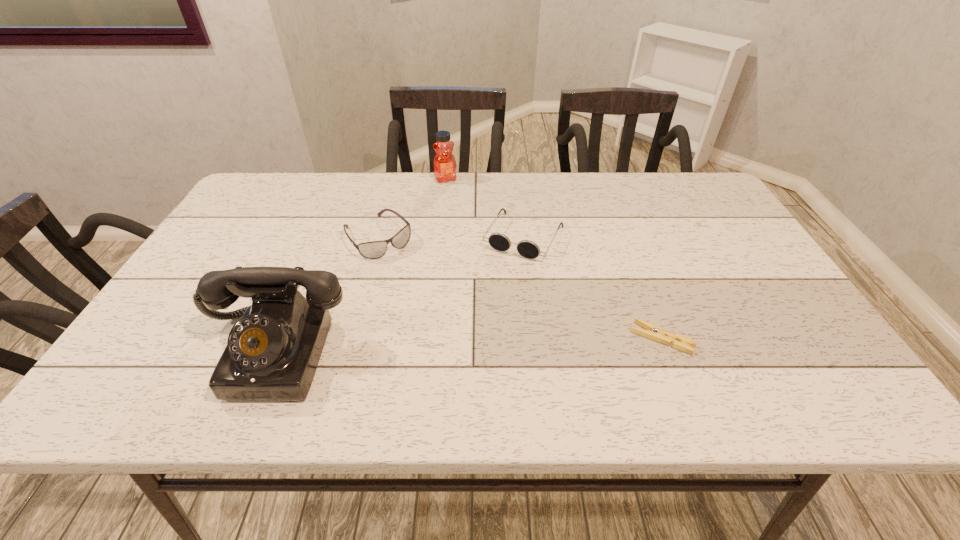
Find the location of a particular element. This screenshot has width=960, height=540. unoccupied position between the fourth object from left to right and the clothespin is located at coordinates (593, 288).

You are a GUI agent. You are given a task and a screenshot of the screen. Output one action in this format:
    pyautogui.click(x=<x>, y=<y>)
    Task: Click on the vacant point located between the third object from left to right and the fourth object from left to right
    This screenshot has width=960, height=540.
    Given the screenshot: What is the action you would take?
    (x=485, y=208)

Image resolution: width=960 pixels, height=540 pixels. Find the location of `empty space that is in between the right sunglasses and the left sunglasses`. empty space that is in between the right sunglasses and the left sunglasses is located at coordinates (451, 237).

Identify the location of free space between the left sunglasses and the rightmost object. The height and width of the screenshot is (540, 960). (520, 288).

You are a GUI agent. You are given a task and a screenshot of the screen. Output one action in this format:
    pyautogui.click(x=<x>, y=<y>)
    Task: Click on the vacant area that lies between the clothespin and the second object from right to left
    The width and height of the screenshot is (960, 540).
    Given the screenshot: What is the action you would take?
    pyautogui.click(x=593, y=288)

The height and width of the screenshot is (540, 960). In order to click on free space between the telephone and the honey in this screenshot , I will do `click(360, 265)`.

In order to click on empty space between the left sunglasses and the fourth object from left to right in this screenshot , I will do `click(451, 237)`.

This screenshot has height=540, width=960. I want to click on free spot between the fourth shortest object and the right sunglasses, so click(x=485, y=208).

Identify which object is located as the nearest to the second object from right to left. Please provide its 2D coordinates. Your answer should be formatted as a tuple, i.e. [(x, y)], where the tuple contains the x and y coordinates of a point satisfying the conditions above.

[(444, 161)]

The width and height of the screenshot is (960, 540). I want to click on object that is the second nearest to the tallest object, so click(x=498, y=241).